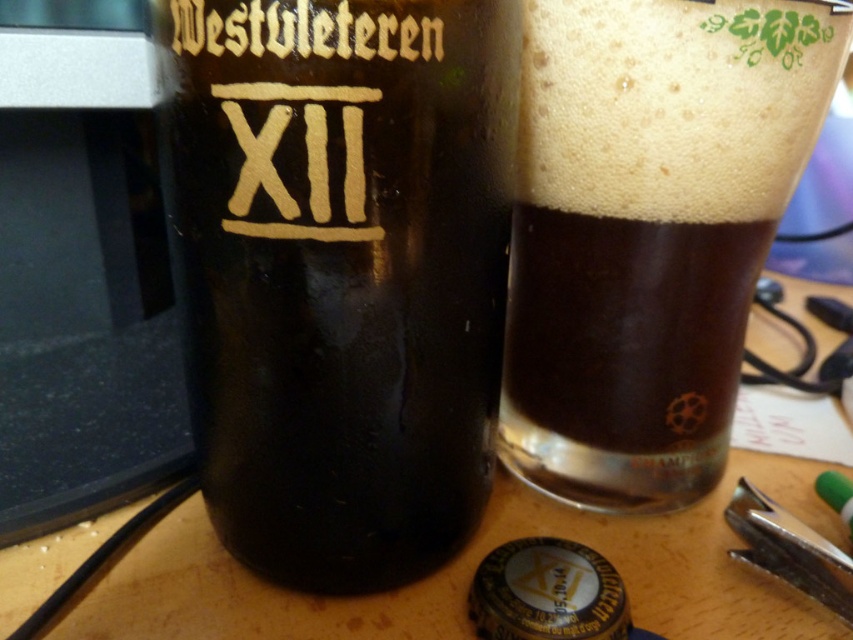
You are a barista who needs to place a coaster at the exact center of the table. The table has a coordinate system where the bottom left corner is the origin point. The matte glass bottle at center is located at point 0.425, 0.400. Where should you place the coaster to be exactly at the center of the table?

The center of the table is at point (426, 320). Since the matte glass bottle at center is at (340, 272), you should place the coaster at (426, 320) to be exactly at the center of the table.

You are a bartender arranging drinks on a shelf. You have a matte glass bottle at center and a dark brown glass at upper center. Which one is closer to you?

The matte glass bottle at center is closer to you because it is in front of the dark brown glass at upper center.

You are setting up a bar display and need to arrange the matte glass bottle at center and the dark brown glass at upper center on a shelf. The shelf has a width of 10 cm. Can both items fit side by side without overlapping?

The matte glass bottle at center is narrower than the dark brown glass at upper center. However, since we don not know the exact widths of both items, we cannot confirm if their combined width is within the 10 cm shelf space. Additional measurements are needed to determine if they can fit together without overlapping.